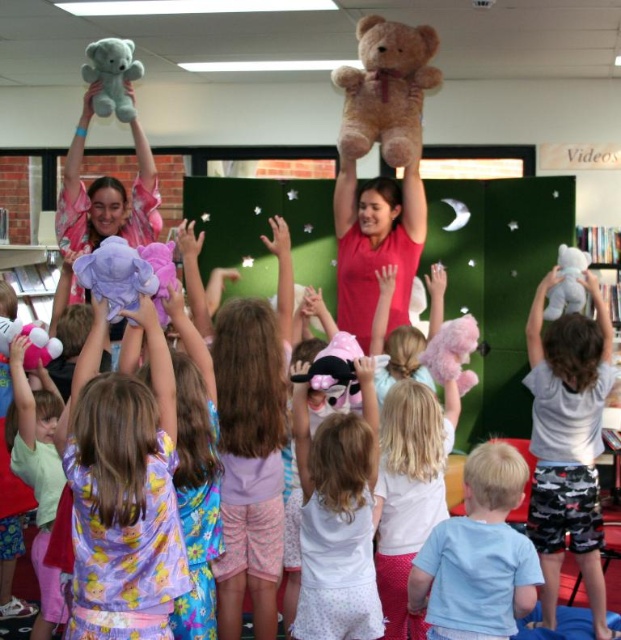
You are a photographer taking a picture of the white polka dot dress at center and the fuzzy pink teddy bear at center. Which object should you focus on first to ensure both are in sharp focus?

The white polka dot dress at center is closer to the viewer than the fuzzy pink teddy bear at center, so you should focus on the white polka dot dress at center first to ensure both are in sharp focus.

You are a teacher in the classroom and want to place a new poster on the wall directly above the pink plush bear at upper left. Where should you position the poster?

The pink plush bear at upper left is located at point (37, 476), so you should position the poster directly above this coordinate.

You are a photographer standing in front of the classroom scene. You want to take a photo of the purple satin dress at center and the light blue plush bear at upper left. Which object will appear larger in your photo?

The purple satin dress at center will appear larger in the photo because it is closer to the viewer than the light blue plush bear at upper left.